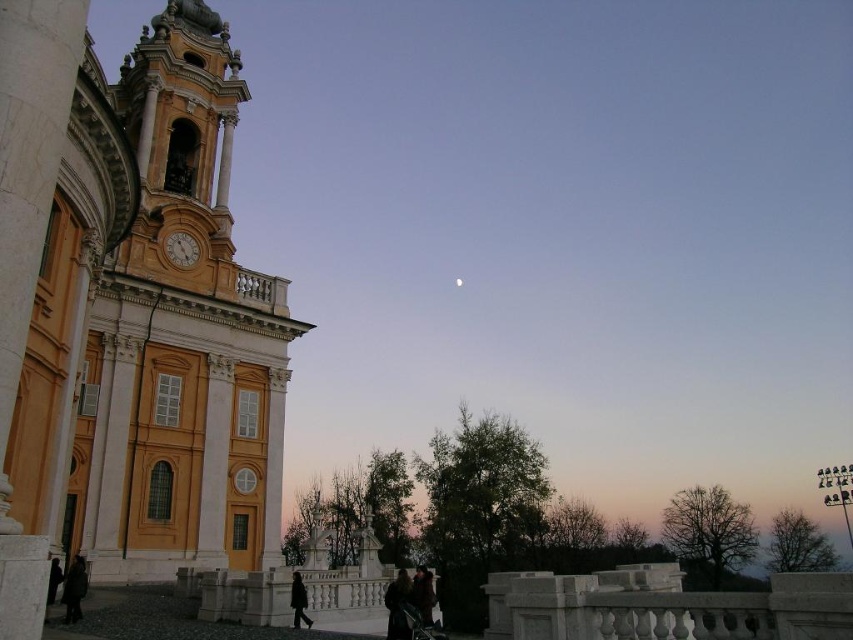
Question: Which of these objects is positioned farthest from the yellow matte church at left?

Choices:
 (A) dark brown leather coat at lower center
 (B) dark brown coat at lower left

Answer: (A)

Question: Which object is the closest to the black wool coat at lower center?

Choices:
 (A) yellow matte church at left
 (B) wooden clock at upper left
 (C) white matte moon at upper center
 (D) dark brown coat at lower left

Answer: (D)

Question: Does dark brown coat at lower left have a greater width compared to dark brown leather coat at lower center?

Choices:
 (A) yes
 (B) no

Answer: (A)

Question: Which object is farther from the camera taking this photo?

Choices:
 (A) yellow matte church at left
 (B) black wool coat at lower center
 (C) dark brown coat at lower center
 (D) dark brown coat at lower left

Answer: (B)

Question: Does dark brown coat at lower left have a lesser width compared to white matte moon at upper center?

Choices:
 (A) yes
 (B) no

Answer: (B)

Question: Does yellow matte church at left lie in front of wooden clock at upper left?

Choices:
 (A) no
 (B) yes

Answer: (B)